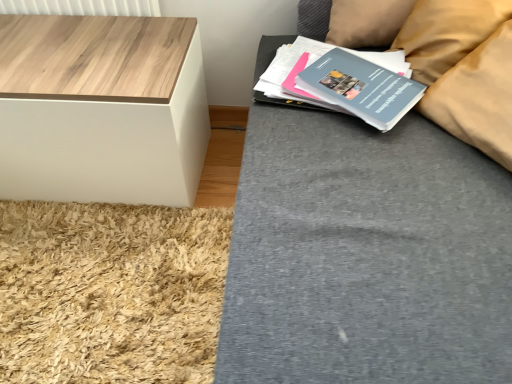
At what (x,y) coordinates should I click in order to perform the action: click on free space above matte gray paperback book at upper right, the first paperback book when ordered from front to back (from a real-world perspective). Please return your answer as a coordinate pair (x, y). Looking at the image, I should click on pos(348,76).